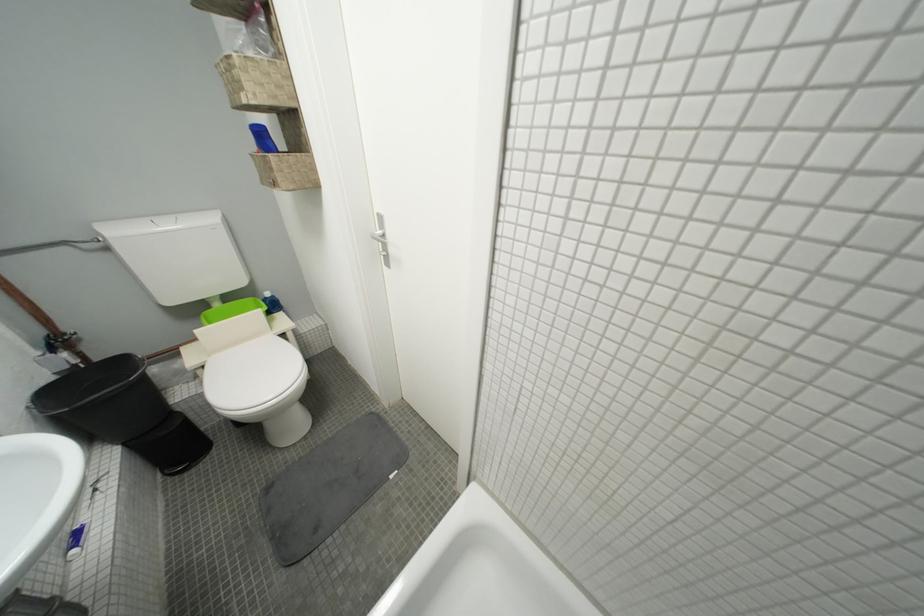
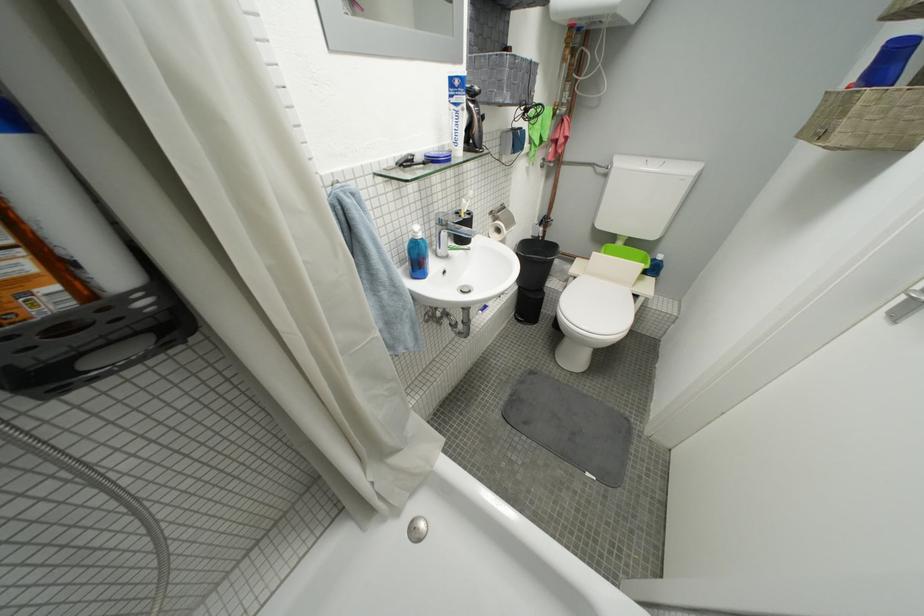
Question: I am providing you with two images of the same scene from different viewpoints. Please identify which objects are invisible in image2.

Choices:
 (A) blue soap dispenser
 (B) toilet paper roll
 (C) bathtub drain stopper
 (D) none of these

Answer: (D)